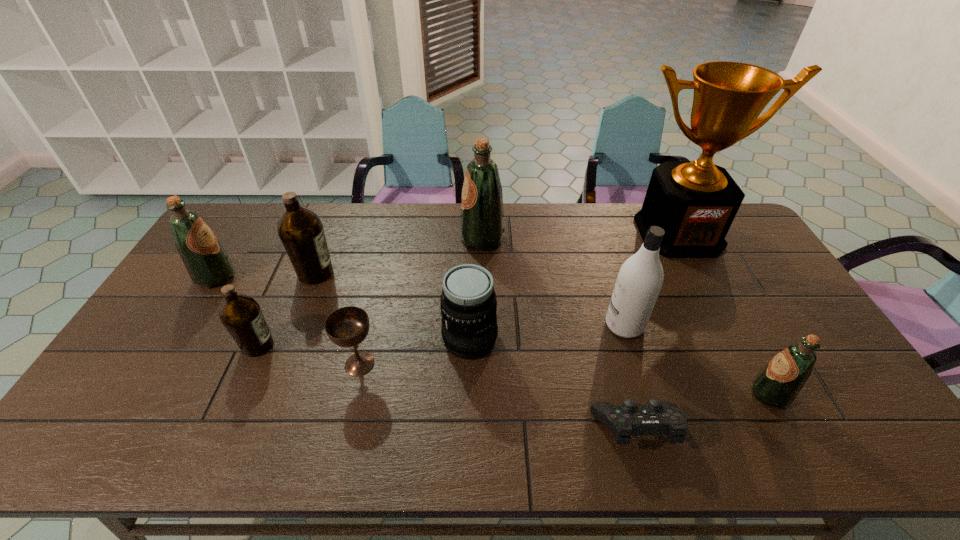
The image size is (960, 540). In order to click on vacant region located 0.100m on the right of the ninth tallest object in this screenshot , I will do `click(417, 364)`.

Find the location of `free space located on the right of the shortest object`. free space located on the right of the shortest object is located at coordinates (844, 430).

The height and width of the screenshot is (540, 960). Identify the location of trophy cup present at the far edge. (695, 203).

I want to click on olive oil that is at the far edge, so click(482, 217).

Find the location of `object at the near edge`. object at the near edge is located at coordinates (656, 417).

Locate an element on the screen. The width and height of the screenshot is (960, 540). object that is at the left edge is located at coordinates (208, 265).

Find the location of a particular element. Image resolution: width=960 pixels, height=540 pixels. object at the right edge is located at coordinates (695, 203).

Where is `object present at the far right corner`? The width and height of the screenshot is (960, 540). object present at the far right corner is located at coordinates (695, 203).

You are a GUI agent. You are given a task and a screenshot of the screen. Output one action in this format:
    pyautogui.click(x=<x>, y=<y>)
    Task: Click on the free space at the far edge of the desktop
    This screenshot has height=540, width=960.
    Given the screenshot: What is the action you would take?
    pyautogui.click(x=353, y=237)

Locate an element on the screen. The width and height of the screenshot is (960, 540). vacant space at the near edge of the desktop is located at coordinates (186, 437).